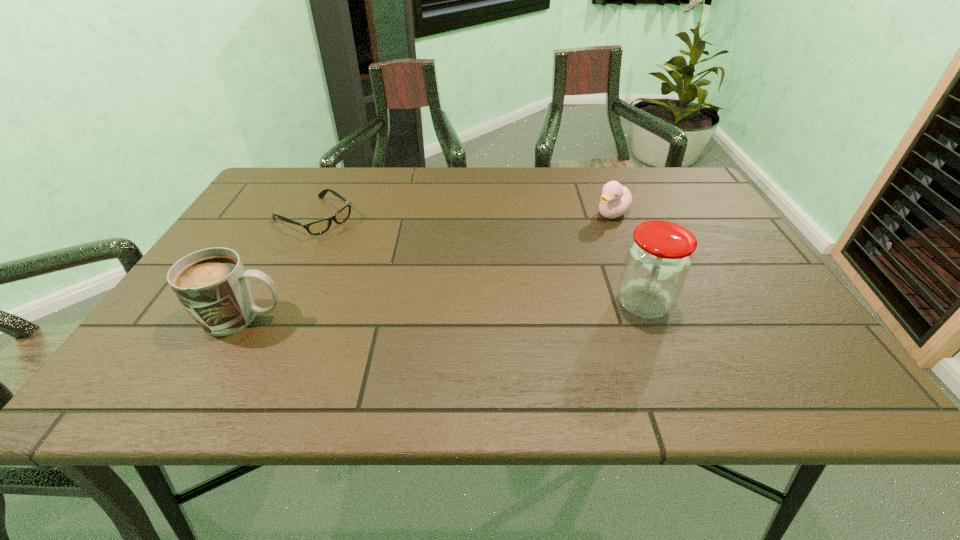
You are a GUI agent. You are given a task and a screenshot of the screen. Output one action in this format:
    pyautogui.click(x=<x>, y=<y>)
    Task: Click on the mug
    
    Given the screenshot: What is the action you would take?
    pyautogui.click(x=212, y=284)

Locate an element on the screen. the tallest object is located at coordinates (658, 259).

Locate an element on the screen. The height and width of the screenshot is (540, 960). duckling is located at coordinates (615, 200).

The height and width of the screenshot is (540, 960). Identify the location of the shortest object. (318, 227).

At what (x,y) coordinates should I click in order to perform the action: click on free space located on the side of the second tallest object with the handle. Please return your answer as a coordinate pair (x, y). The height and width of the screenshot is (540, 960). Looking at the image, I should click on (430, 318).

At what (x,y) coordinates should I click in order to perform the action: click on vacant space situated 0.380m on the back of the tallest object. Please return your answer as a coordinate pair (x, y). This screenshot has height=540, width=960. Looking at the image, I should click on (601, 197).

Where is `vacant point located 0.290m on the front-facing side of the duckling`? The width and height of the screenshot is (960, 540). vacant point located 0.290m on the front-facing side of the duckling is located at coordinates (537, 272).

Locate an element on the screen. This screenshot has height=540, width=960. vacant space located 0.390m on the front-facing side of the duckling is located at coordinates (509, 293).

Locate an element on the screen. free spot located 0.400m on the front-facing side of the duckling is located at coordinates pyautogui.click(x=506, y=295).

At what (x,y) coordinates should I click in order to perform the action: click on vacant space located 0.370m on the front-facing side of the spectacles. Please return your answer as a coordinate pair (x, y). Looking at the image, I should click on (442, 296).